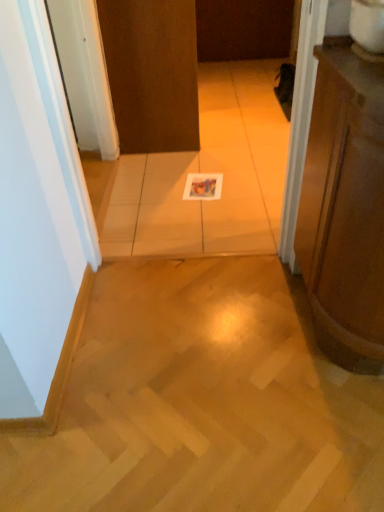
The width and height of the screenshot is (384, 512). I want to click on brown matte door at center, so click(x=152, y=73).

The height and width of the screenshot is (512, 384). Describe the element at coordinates (152, 73) in the screenshot. I see `brown matte door at center` at that location.

Measure the distance between brown matte door at center and camera.

They are 7.12 feet apart.

This screenshot has width=384, height=512. Find the location of `brown matte door at center`. brown matte door at center is located at coordinates (152, 73).